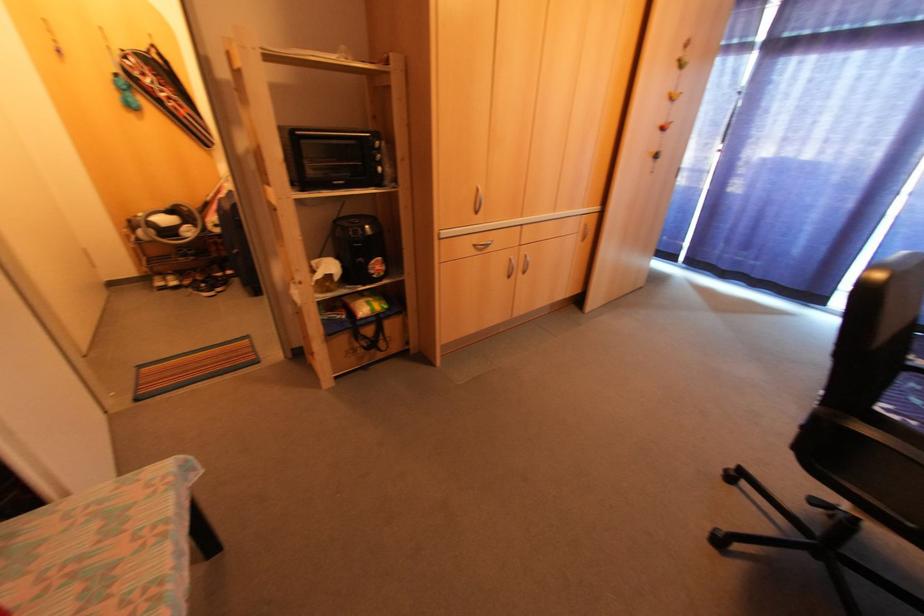
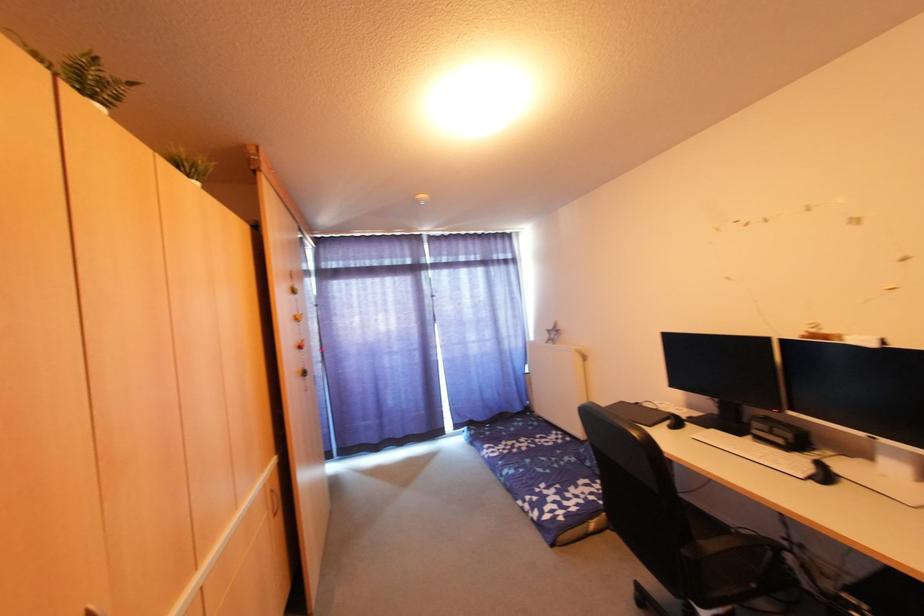
Question: The first image is from the beginning of the video and the second image is from the end. How did the camera likely rotate when shooting the video?

Choices:
 (A) Left
 (B) Right
 (C) Up
 (D) Down

Answer: (B)